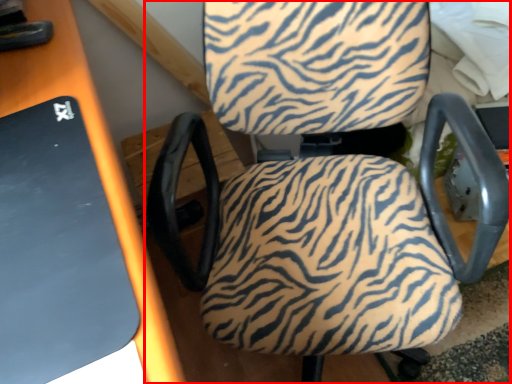
Question: From the image's perspective, where is chair (annotated by the red box) located relative to table?

Choices:
 (A) above
 (B) below

Answer: (A)